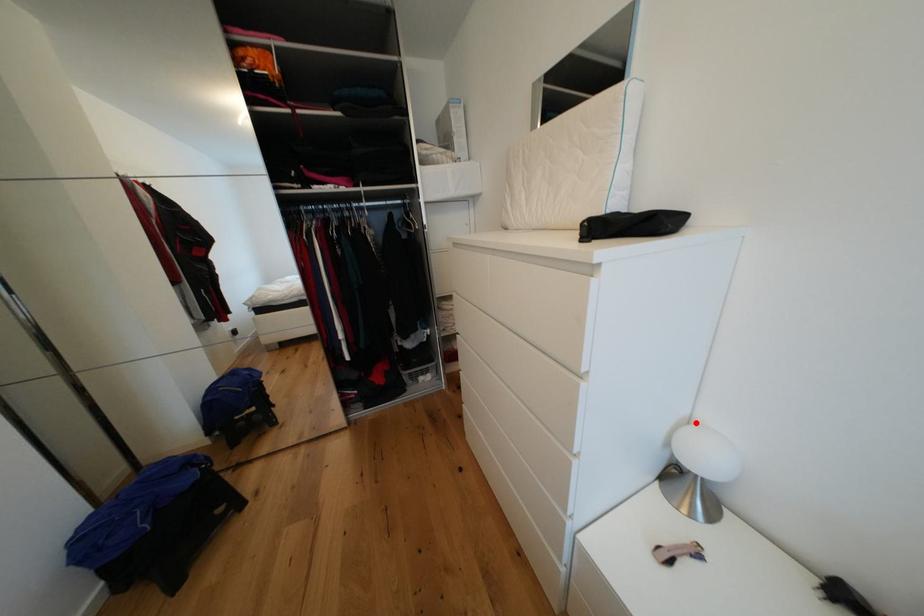
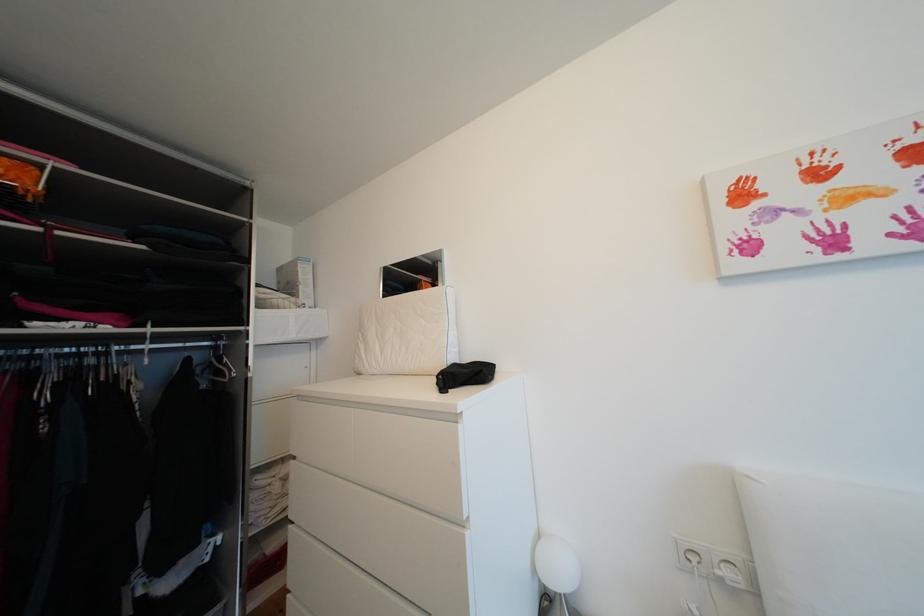
In the second image, find the point that corresponds to the highlighted location in the first image.

(545, 537)